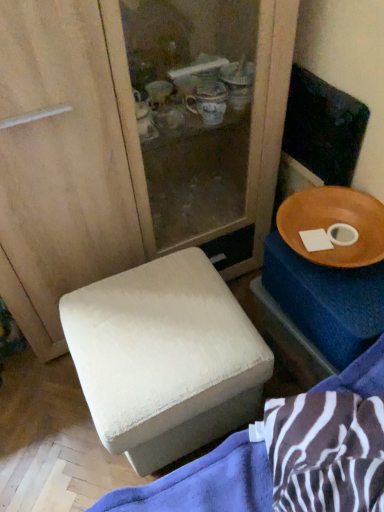
What do you see at coordinates (333, 226) in the screenshot?
I see `wooden bowl at right` at bounding box center [333, 226].

The image size is (384, 512). Describe the element at coordinates (165, 358) in the screenshot. I see `white fabric ottoman at lower left` at that location.

Where is `white fabric ottoman at lower left`? white fabric ottoman at lower left is located at coordinates (165, 358).

At what (x,y) coordinates should I click in order to perform the action: click on wooden tray at right. Please return your answer as a coordinate pair (x, y). This screenshot has height=512, width=384. Looking at the image, I should click on (326, 301).

Can you confirm if wooden tray at right is positioned to the left of wooden bowl at right?

No, wooden tray at right is not to the left of wooden bowl at right.

Is wooden tray at right not within wooden bowl at right?

wooden tray at right is positioned outside wooden bowl at right.

Could you tell me if wooden tray at right is facing wooden bowl at right?

No, wooden tray at right is not turned towards wooden bowl at right.

Can you confirm if wooden bowl at right is bigger than wooden tray at right?

No, wooden bowl at right is not bigger than wooden tray at right.

Does wooden bowl at right have a greater height compared to wooden tray at right?

No.

Where is `tableware above the wooden tray at right (from the image's perspective)`? This screenshot has width=384, height=512. tableware above the wooden tray at right (from the image's perspective) is located at coordinates (333, 226).

Would you say wooden bowl at right contains wooden tray at right?

Definitely not — wooden tray at right is not inside wooden bowl at right.

Is point (313, 212) less distant than point (189, 268)?

No, it is behind (189, 268).

Considering the relative sizes of wooden bowl at right and white fabric ottoman at lower left in the image provided, is wooden bowl at right bigger than white fabric ottoman at lower left?

No, wooden bowl at right is not bigger than white fabric ottoman at lower left.

Are wooden bowl at right and white fabric ottoman at lower left located far from each other?

wooden bowl at right is actually quite close to white fabric ottoman at lower left.

Is wooden bowl at right not inside white fabric ottoman at lower left?

Indeed, wooden bowl at right is completely outside white fabric ottoman at lower left.

Does wooden tray at right appear on the left side of white fabric ottoman at lower left?

In fact, wooden tray at right is to the right of white fabric ottoman at lower left.

Which of these two, wooden tray at right or white fabric ottoman at lower left, is bigger?

white fabric ottoman at lower left is bigger.

Based on the photo, considering the positions of objects wooden tray at right and white fabric ottoman at lower left in the image provided, who is behind, wooden tray at right or white fabric ottoman at lower left?

wooden tray at right is further from the camera.

Which of these two, wooden tray at right or white fabric ottoman at lower left, stands shorter?

With less height is white fabric ottoman at lower left.

Is white fabric ottoman at lower left closer to camera compared to wooden bowl at right?

That is True.

I want to click on furniture lying below the wooden bowl at right (from the image's perspective), so coord(165,358).

Is white fabric ottoman at lower left aimed at wooden bowl at right?

No, white fabric ottoman at lower left is not aimed at wooden bowl at right.

How different are the orientations of white fabric ottoman at lower left and wooden tray at right in degrees?

white fabric ottoman at lower left and wooden tray at right are facing 0.589 degrees away from each other.

Looking at this image, which is behind, white fabric ottoman at lower left or wooden tray at right?

wooden tray at right is behind.

Is white fabric ottoman at lower left wider or thinner than wooden tray at right?

Considering their sizes, white fabric ottoman at lower left looks broader than wooden tray at right.

Is white fabric ottoman at lower left outside of wooden tray at right?

Yes.

What are the coordinates of `tableware that appears on the left of wooden tray at right` in the screenshot? It's located at (333, 226).

This screenshot has height=512, width=384. In order to click on changing table lying in front of the wooden bowl at right in this screenshot , I will do `click(326, 301)`.

Estimate the real-world distances between objects in this image. Which object is closer to white fabric ottoman at lower left, wooden tray at right or wooden bowl at right?

wooden tray at right.

From the image, which object appears to be nearer to wooden tray at right, wooden bowl at right or white fabric ottoman at lower left?

Answer: Among the two, wooden bowl at right is located nearer to wooden tray at right.

Considering their positions, is white fabric ottoman at lower left positioned further to wooden bowl at right than wooden tray at right?

Among the two, white fabric ottoman at lower left is located further to wooden bowl at right.

From the image, which object appears to be farther from wooden tray at right, white fabric ottoman at lower left or wooden bowl at right?

white fabric ottoman at lower left is further to wooden tray at right.

Considering their positions, is wooden tray at right positioned further to wooden bowl at right than white fabric ottoman at lower left?

white fabric ottoman at lower left lies further to wooden bowl at right than the other object.

When comparing their distances from white fabric ottoman at lower left, does wooden bowl at right or wooden tray at right seem further?

Based on the image, wooden bowl at right appears to be further to white fabric ottoman at lower left.

Where is `tableware situated between white fabric ottoman at lower left and wooden tray at right from left to right`? The image size is (384, 512). tableware situated between white fabric ottoman at lower left and wooden tray at right from left to right is located at coordinates (333, 226).